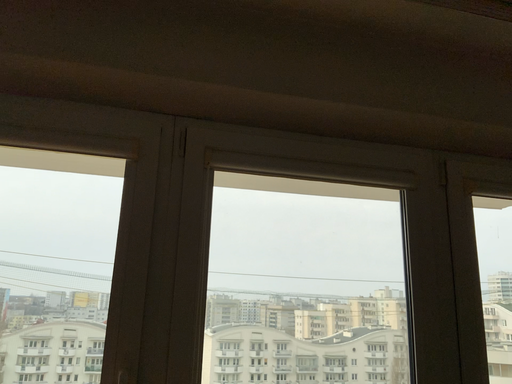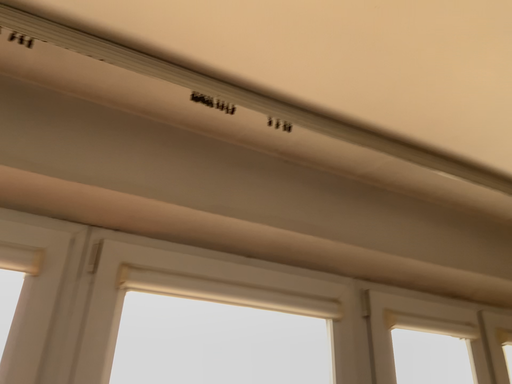
Question: Which way did the camera rotate in the video?

Choices:
 (A) rotated downward
 (B) rotated upward

Answer: (B)